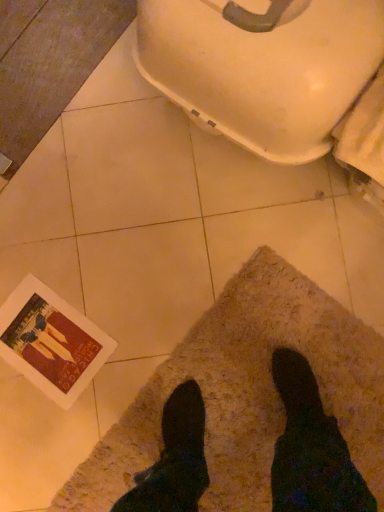
Find the location of a particular element. Image resolution: width=384 pixels, height=512 pixels. blank space situated above beige shaggy mat at lower center (from a real-world perspective) is located at coordinates (258, 409).